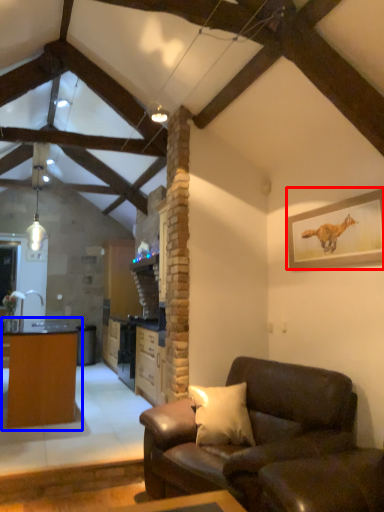
Question: Which of the following is the farthest to the observer, picture frame (highlighted by a red box) or table (highlighted by a blue box)?

Choices:
 (A) picture frame
 (B) table

Answer: (B)